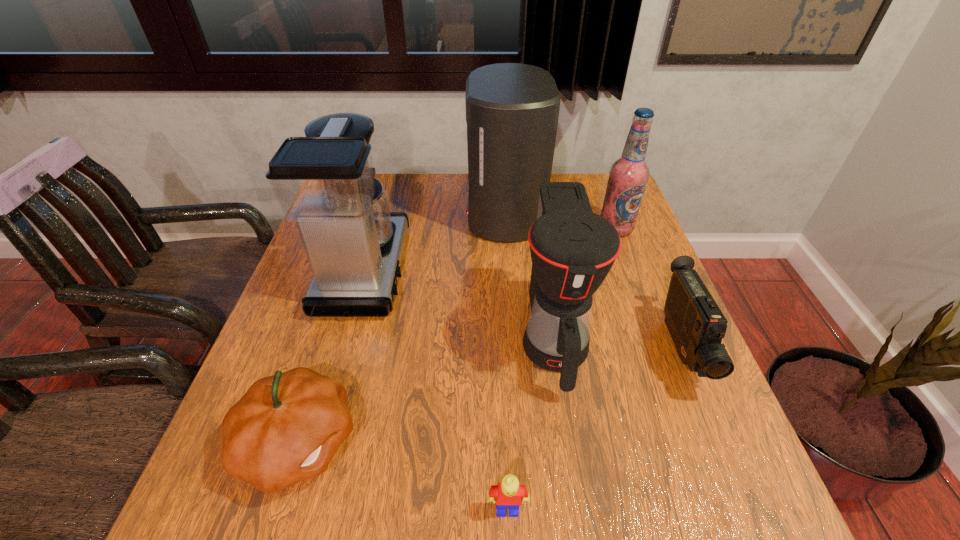
Find the location of `vacant space at the left edge of the desktop`. vacant space at the left edge of the desktop is located at coordinates (257, 379).

Image resolution: width=960 pixels, height=540 pixels. I want to click on vacant region at the right edge of the desktop, so click(x=613, y=283).

Locate an element on the screen. vacant space at the far left corner of the desktop is located at coordinates (388, 176).

Locate an element on the screen. The height and width of the screenshot is (540, 960). vacant position at the far right corner of the desktop is located at coordinates (591, 185).

Identify the location of blank region between the leftmost coffee maker and the shortest coffee maker. (460, 305).

Where is `vacant area between the shortest coffee maker and the shortest object`? The height and width of the screenshot is (540, 960). vacant area between the shortest coffee maker and the shortest object is located at coordinates (531, 424).

At what (x,y) coordinates should I click in order to perform the action: click on vacant point located between the shortest coffee maker and the shortest object. Please return your answer as a coordinate pair (x, y). This screenshot has height=540, width=960. Looking at the image, I should click on (531, 424).

Where is `vacant region between the shortest coffee maker and the pumpkin`? The width and height of the screenshot is (960, 540). vacant region between the shortest coffee maker and the pumpkin is located at coordinates (426, 391).

Image resolution: width=960 pixels, height=540 pixels. Find the location of `unoccupied position between the shortest object and the shortest coffee maker`. unoccupied position between the shortest object and the shortest coffee maker is located at coordinates (531, 424).

Locate an element on the screen. vacant area between the alcohol and the pumpkin is located at coordinates (457, 336).